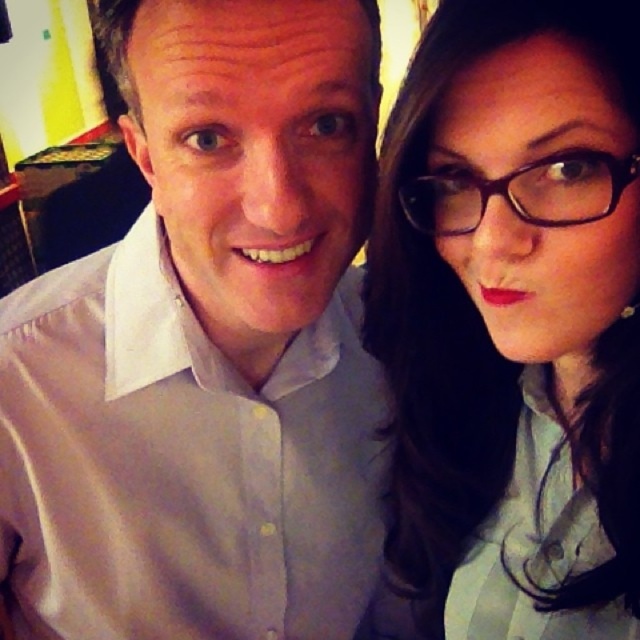
Is matte black glasses at upper right above black plastic glasses at upper right?

No, matte black glasses at upper right is not above black plastic glasses at upper right.

Does point (547, 508) come behind point (561, 202)?

Yes.

Which is in front, point (570, 246) or point (614, 202)?

Positioned in front is point (614, 202).

The width and height of the screenshot is (640, 640). In order to click on matte black glasses at upper right in this screenshot , I will do `click(515, 317)`.